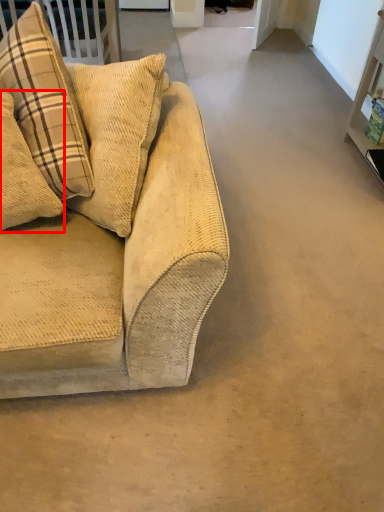
Question: From the image, what is the correct spatial relationship of pillow (annotated by the red box) in relation to studio couch?

Choices:
 (A) right
 (B) left

Answer: (B)